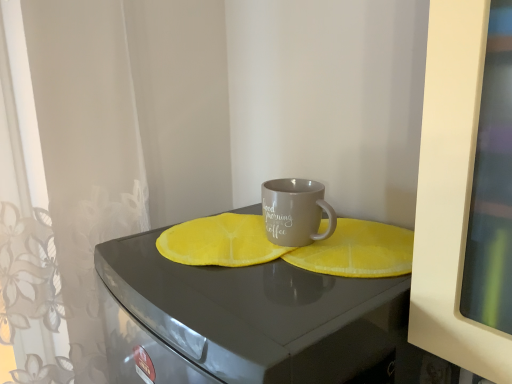
At what (x,y) coordinates should I click in order to perform the action: click on matte gray mug at center. Please return your answer as a coordinate pair (x, y). Looking at the image, I should click on (295, 211).

Describe the element at coordinates (295, 211) in the screenshot. I see `matte gray mug at center` at that location.

You are a GUI agent. You are given a task and a screenshot of the screen. Output one action in this format:
    pyautogui.click(x=<x>, y=<y>)
    Task: Click on the matte gray table at center
    
    Given the screenshot: What is the action you would take?
    pyautogui.click(x=254, y=316)

Describe the element at coordinates (254, 316) in the screenshot. I see `matte gray table at center` at that location.

In order to face matte gray table at center, should I rotate leftwards or rightwards?

Rotate your view right by about 2.787°.

Image resolution: width=512 pixels, height=384 pixels. What are the coordinates of `matte gray mug at center` in the screenshot? It's located at (295, 211).

Considering the relative positions of matte gray mug at center and matte gray table at center in the image provided, is matte gray mug at center to the left of matte gray table at center from the viewer's perspective?

No.

Between matte gray mug at center and matte gray table at center, which one is positioned in front?

matte gray table at center is in front.

Which is farther, (298, 242) or (329, 289)?

The point (298, 242) is farther.

From the image's perspective, which one is positioned higher, matte gray mug at center or matte gray table at center?

matte gray mug at center is shown above in the image.

From a real-world perspective, which is physically below, matte gray mug at center or matte gray table at center?

matte gray table at center.

Is matte gray mug at center wider or thinner than matte gray table at center?

Considering their sizes, matte gray mug at center looks slimmer than matte gray table at center.

Which of these two, matte gray mug at center or matte gray table at center, stands shorter?

Standing shorter between the two is matte gray mug at center.

In terms of size, does matte gray mug at center appear bigger or smaller than matte gray table at center?

Clearly, matte gray mug at center is smaller in size than matte gray table at center.

Is matte gray mug at center outside of matte gray table at center?

matte gray mug at center is positioned outside matte gray table at center.

Is matte gray mug at center not close to matte gray table at center?

No, there isn't a large distance between matte gray mug at center and matte gray table at center.

Could you tell me if matte gray mug at center is turned towards matte gray table at center?

No, matte gray mug at center is not facing towards matte gray table at center.

How far apart are matte gray mug at center and matte gray table at center?

The distance of matte gray mug at center from matte gray table at center is 8.98 inches.

You are a GUI agent. You are given a task and a screenshot of the screen. Output one action in this format:
    pyautogui.click(x=<x>, y=<y>)
    Task: Click on the table located on the left of matte gray mug at center
    The image size is (512, 384).
    Given the screenshot: What is the action you would take?
    pyautogui.click(x=254, y=316)

Looking at this image, considering the relative positions of matte gray table at center and matte gray mug at center in the image provided, is matte gray table at center to the right of matte gray mug at center from the viewer's perspective?

Incorrect, matte gray table at center is not on the right side of matte gray mug at center.

Does matte gray table at center come behind matte gray mug at center?

No.

Is point (278, 358) closer or farther from the camera than point (313, 188)?

Point (278, 358) appears to be closer to the viewer than point (313, 188).

From the image's perspective, which is below, matte gray table at center or matte gray mug at center?

matte gray table at center is shown below in the image.

From a real-world perspective, is matte gray table at center positioned above or below matte gray mug at center?

matte gray table at center is situated lower than matte gray mug at center in the real world.

Considering the relative sizes of matte gray table at center and matte gray mug at center in the image provided, is matte gray table at center wider than matte gray mug at center?

Yes, matte gray table at center is wider than matte gray mug at center.

Can you confirm if matte gray table at center is shorter than matte gray mug at center?

Incorrect, the height of matte gray table at center does not fall short of that of matte gray mug at center.

In terms of size, does matte gray table at center appear bigger or smaller than matte gray mug at center?

In the image, matte gray table at center appears to be larger than matte gray mug at center.

Would you say matte gray table at center contains matte gray mug at center?

That's incorrect, matte gray mug at center is not inside matte gray table at center.

In the scene shown: Is matte gray table at center in contact with matte gray mug at center?

No, matte gray table at center is not touching matte gray mug at center.

Is matte gray table at center positioned with its back to matte gray mug at center?

No, matte gray table at center's orientation is not away from matte gray mug at center.

What's the angular difference between matte gray table at center and matte gray mug at center's facing directions?

There is a 1.92-degree angle between the facing directions of matte gray table at center and matte gray mug at center.

The height and width of the screenshot is (384, 512). Identify the location of table that is below the matte gray mug at center (from the image's perspective). (254, 316).

In order to click on table lying on the left of matte gray mug at center in this screenshot , I will do `click(254, 316)`.

Where is `coffee cup above the matte gray table at center (from the image's perspective)`? coffee cup above the matte gray table at center (from the image's perspective) is located at coordinates (295, 211).